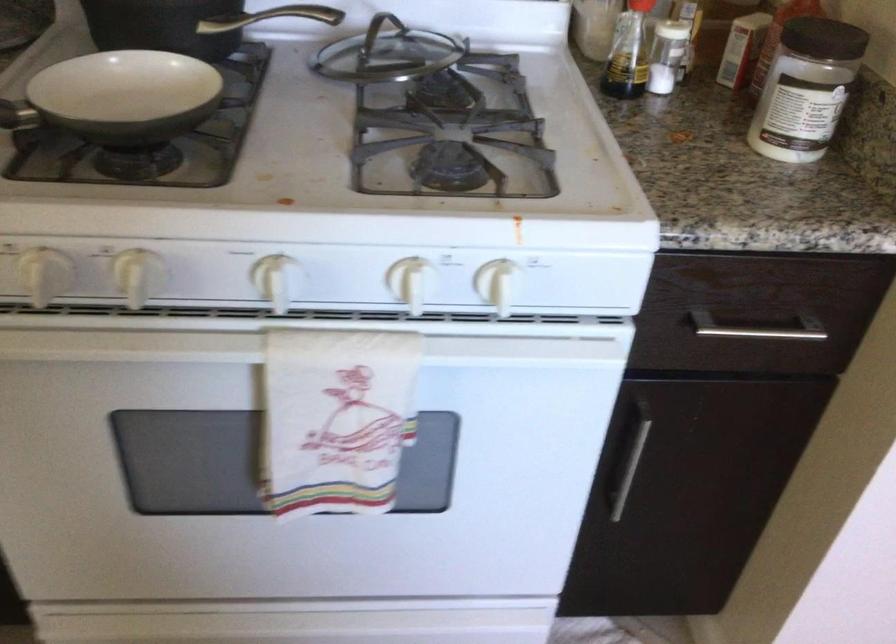
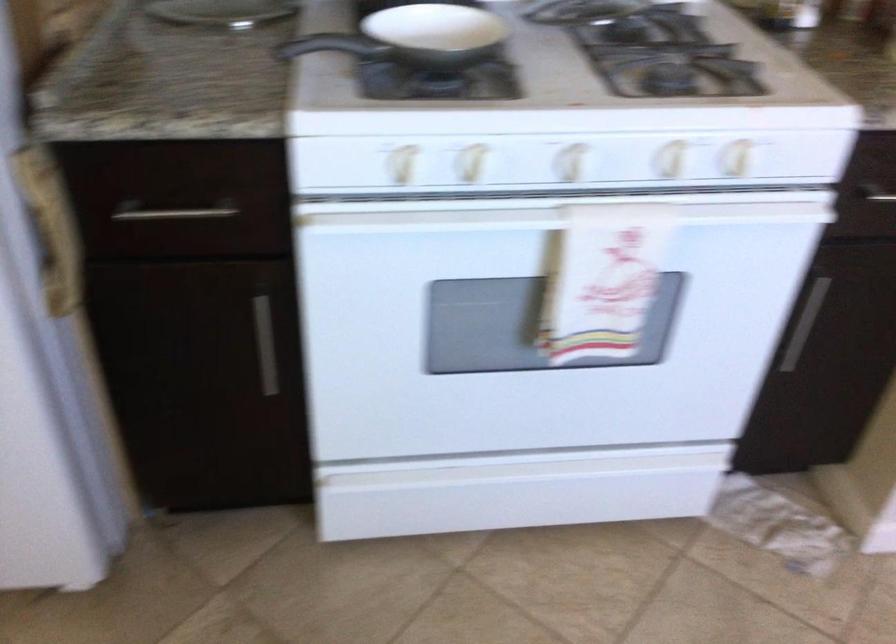
Locate, in the second image, the point that corresponds to pixel 142 279 in the first image.

(471, 163)